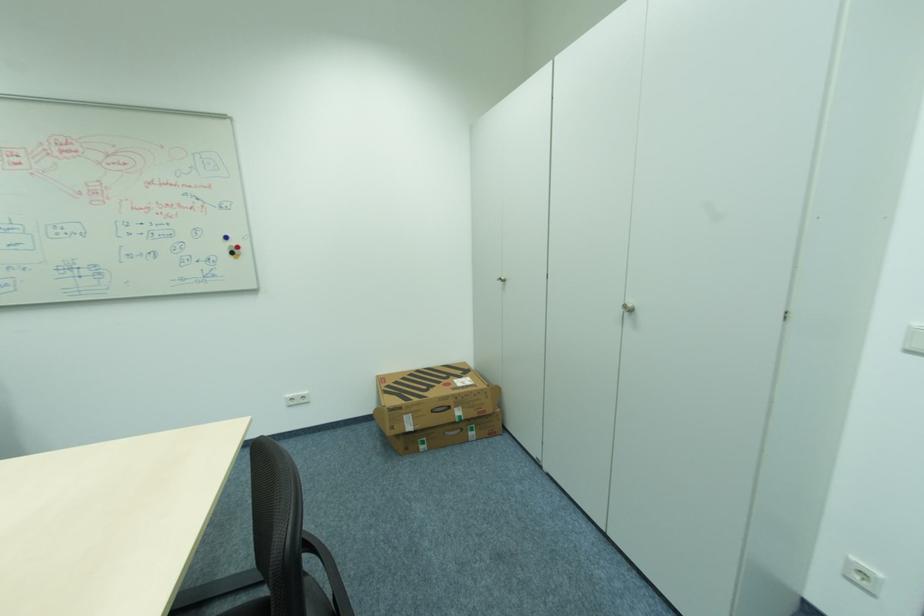
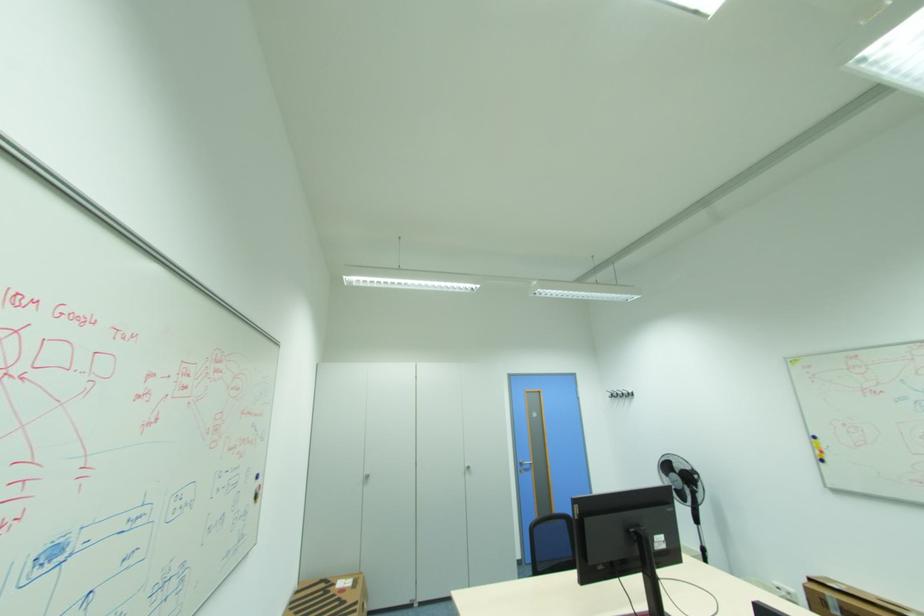
Where in the second image is the point corresponding to (509,281) from the first image?

(372, 477)